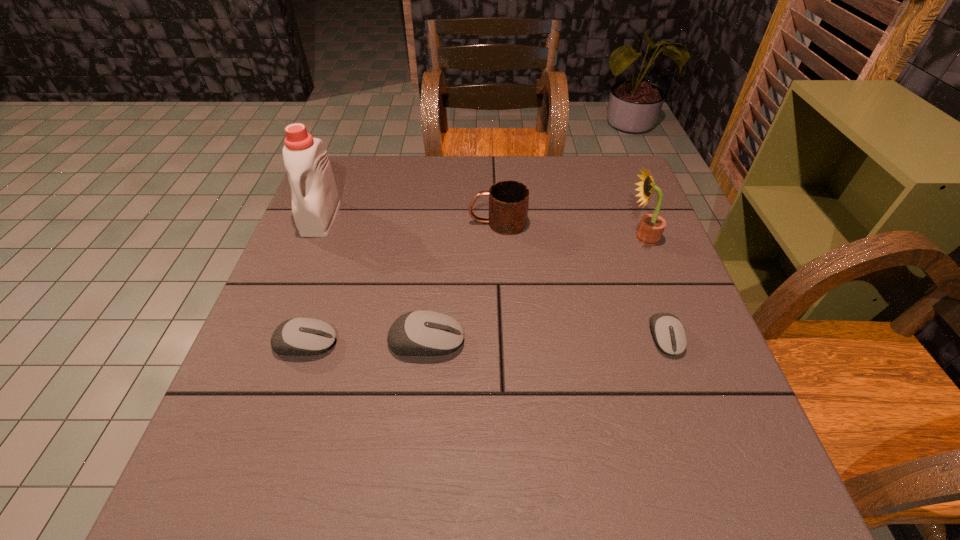
Locate an element on the screen. vacant area at the far left corner of the desktop is located at coordinates (351, 160).

Locate an element on the screen. free location at the far right corner of the desktop is located at coordinates [x=600, y=159].

The width and height of the screenshot is (960, 540). I want to click on blank region between the tallest computer equipment and the second tallest object, so click(535, 290).

Where is `unoccupied area between the mug and the third object from left to right`? The width and height of the screenshot is (960, 540). unoccupied area between the mug and the third object from left to right is located at coordinates (462, 282).

What are the coordinates of `vacant space in between the tallest computer equipment and the third tallest object` in the screenshot? It's located at (462, 282).

This screenshot has height=540, width=960. What are the coordinates of `vacant area between the second shortest computer equipment and the third object from left to right` in the screenshot? It's located at (366, 342).

You are a GUI agent. You are given a task and a screenshot of the screen. Output one action in this format:
    pyautogui.click(x=<x>, y=<y>)
    Task: Click on the unoccupied area between the tallest object and the sunflower
    The image size is (960, 540).
    Given the screenshot: What is the action you would take?
    pyautogui.click(x=482, y=228)

Where is `free area in between the detergent and the shortest computer equipment`? free area in between the detergent and the shortest computer equipment is located at coordinates (493, 278).

At what (x,y) coordinates should I click in order to perform the action: click on blank region between the tallest object and the mug. Please return your answer as a coordinate pair (x, y). This screenshot has width=960, height=540. Looking at the image, I should click on tap(409, 220).

Locate an element on the screen. This screenshot has height=540, width=960. empty location between the second shortest object and the tallest object is located at coordinates (313, 281).